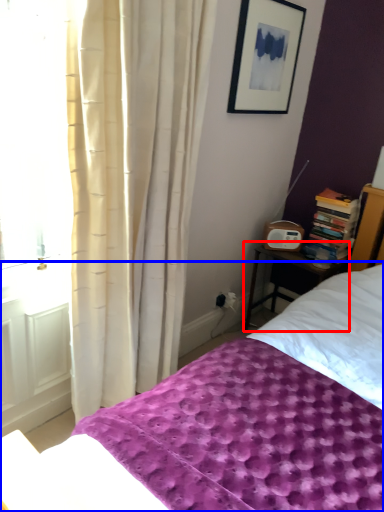
Question: Which object appears farthest to the camera in this image, nightstand (highlighted by a red box) or bed (highlighted by a blue box)?

Choices:
 (A) nightstand
 (B) bed

Answer: (A)